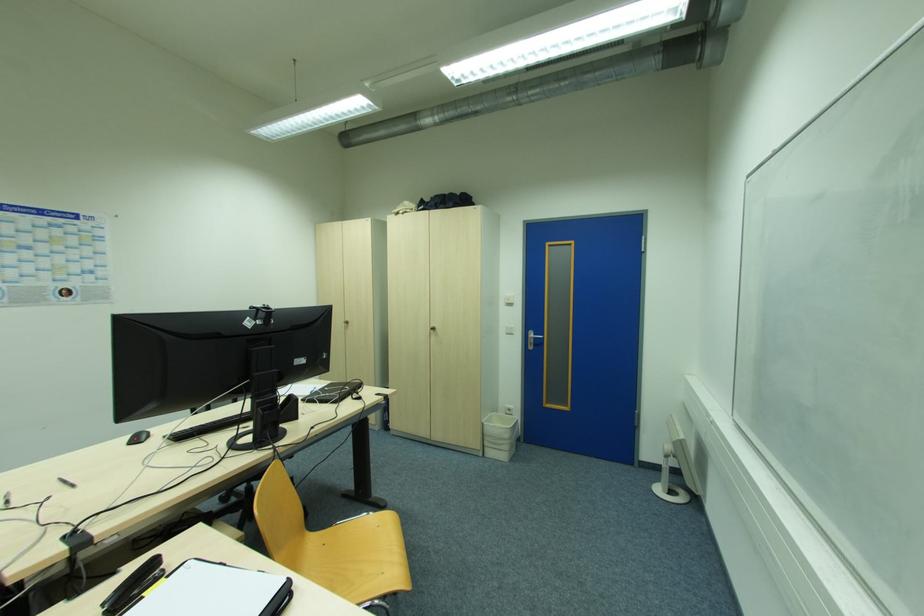
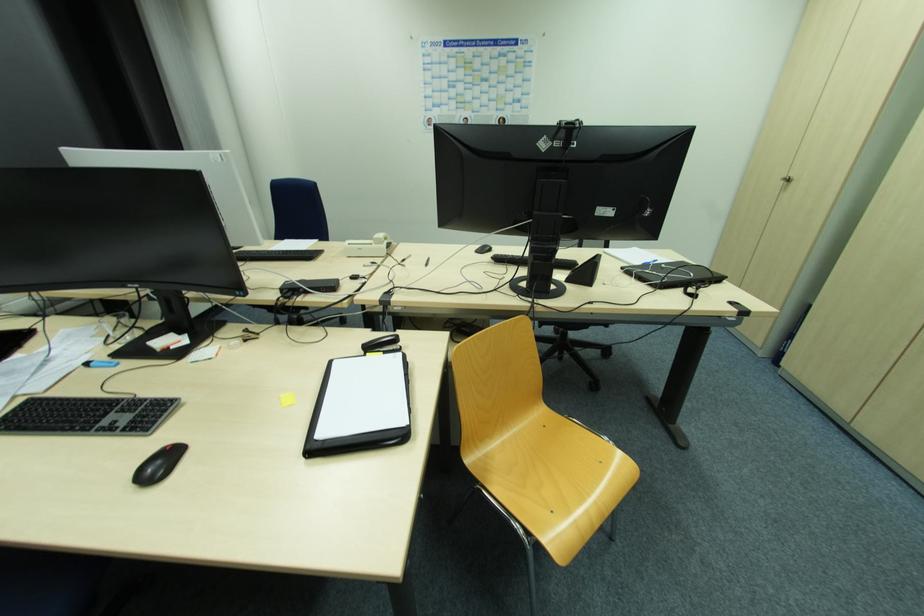
How did the camera likely rotate?

The rotation direction of the camera is left-down.